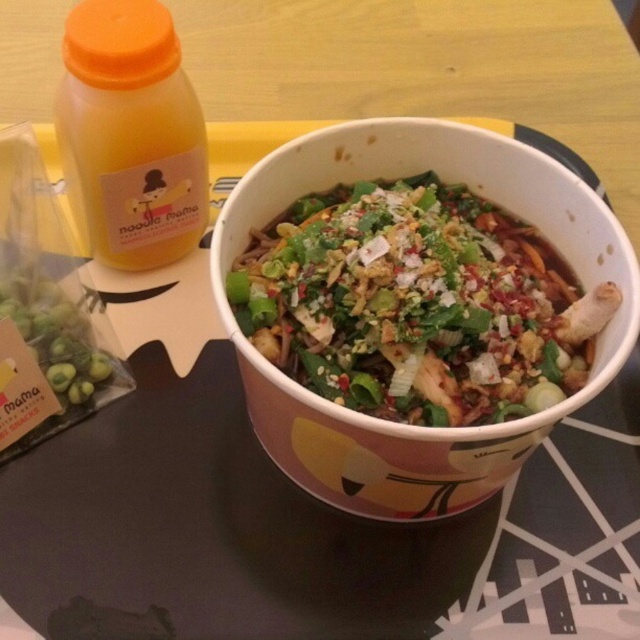
Question: Which point is closer to the camera?

Choices:
 (A) orange plastic bottle at upper left
 (B) green matte olives at lower left

Answer: (B)

Question: Considering the real-world distances, which object is farthest from the orange plastic bottle at upper left?

Choices:
 (A) white paper bowl at center
 (B) green matte olives at lower left

Answer: (A)

Question: Observing the image, what is the correct spatial positioning of white paper bowl at center in reference to green matte olives at lower left?

Choices:
 (A) below
 (B) above

Answer: (B)

Question: Can you confirm if white paper bowl at center is wider than green matte olives at lower left?

Choices:
 (A) no
 (B) yes

Answer: (B)

Question: Is orange plastic bottle at upper left below green matte olives at lower left?

Choices:
 (A) yes
 (B) no

Answer: (B)

Question: Which object is the farthest from the orange plastic bottle at upper left?

Choices:
 (A) green matte olives at lower left
 (B) white paper bowl at center

Answer: (B)